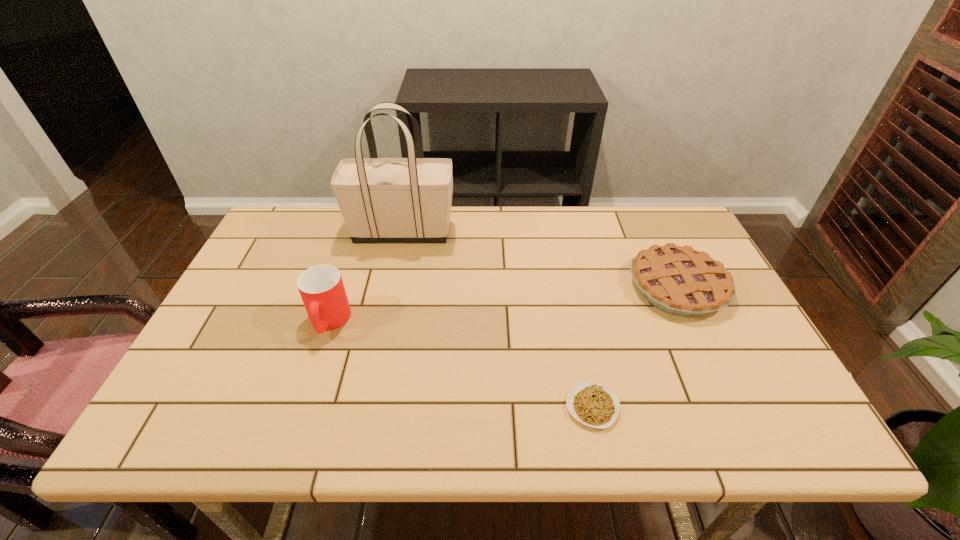
The image size is (960, 540). What are the coordinates of `free space located on the left of the legume` in the screenshot? It's located at (378, 407).

Where is `object at the far edge`? object at the far edge is located at coordinates (382, 200).

You are a GUI agent. You are given a task and a screenshot of the screen. Output one action in this format:
    pyautogui.click(x=<x>, y=<y>)
    Task: Click on the object that is at the near edge
    
    Given the screenshot: What is the action you would take?
    pyautogui.click(x=594, y=405)

Where is `object that is positioned at the right edge`? This screenshot has height=540, width=960. object that is positioned at the right edge is located at coordinates (681, 281).

The width and height of the screenshot is (960, 540). I want to click on vacant region at the far edge of the desktop, so click(x=624, y=234).

Find the location of a particular element. vacant region at the near edge is located at coordinates (329, 419).

You are a GUI agent. You are given a task and a screenshot of the screen. Output one action in this format:
    pyautogui.click(x=<x>, y=<y>)
    Task: Click on the free space at the left edge of the desktop
    This screenshot has width=960, height=540.
    Given the screenshot: What is the action you would take?
    pyautogui.click(x=267, y=330)

Identify the location of vacant space at the right edge of the desktop. The image size is (960, 540). (729, 332).

This screenshot has width=960, height=540. What are the coordinates of `vacant area at the far left corner` in the screenshot? It's located at (303, 217).

Where is `blank region between the legume and the tallest object`? The height and width of the screenshot is (540, 960). blank region between the legume and the tallest object is located at coordinates (497, 319).